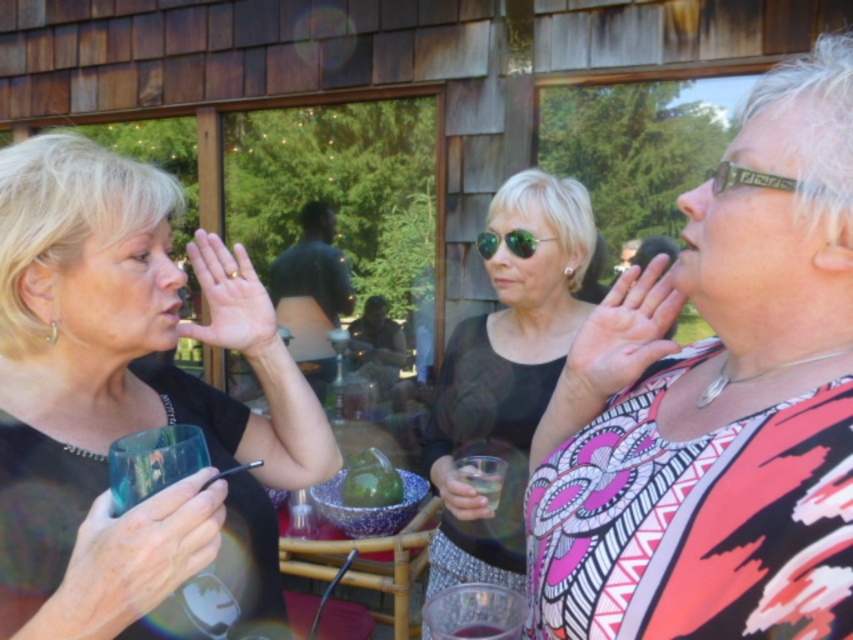
From the picture: You are a photographer at the event and want to capture a closeup of the green reflective sunglasses at center and the translucent glass at lower center in the same frame. Which object should you focus on first if you want to ensure both are in focus?

The green reflective sunglasses at center is wider than the translucent glass at lower center, so focusing on the closer object first would help ensure both are in focus.

You are a photographer at the event and want to capture a closeup shot of both the green reflective sunglasses at center and the translucent glass at lower center in the same frame. Considering their sizes, which object should you focus on first to ensure both are in focus?

The green reflective sunglasses at center is larger than the translucent glass at lower center, so focusing on the larger object first would help ensure both are in focus.